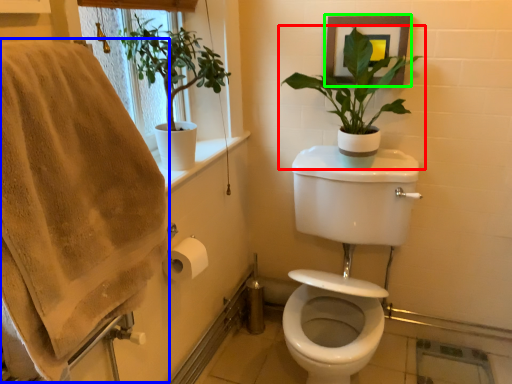
Question: Estimate the real-world distances between objects in this image. Which object is closer to houseplant (highlighted by a red box), bath towel (highlighted by a blue box) or picture frame (highlighted by a green box)?

Choices:
 (A) bath towel
 (B) picture frame

Answer: (B)